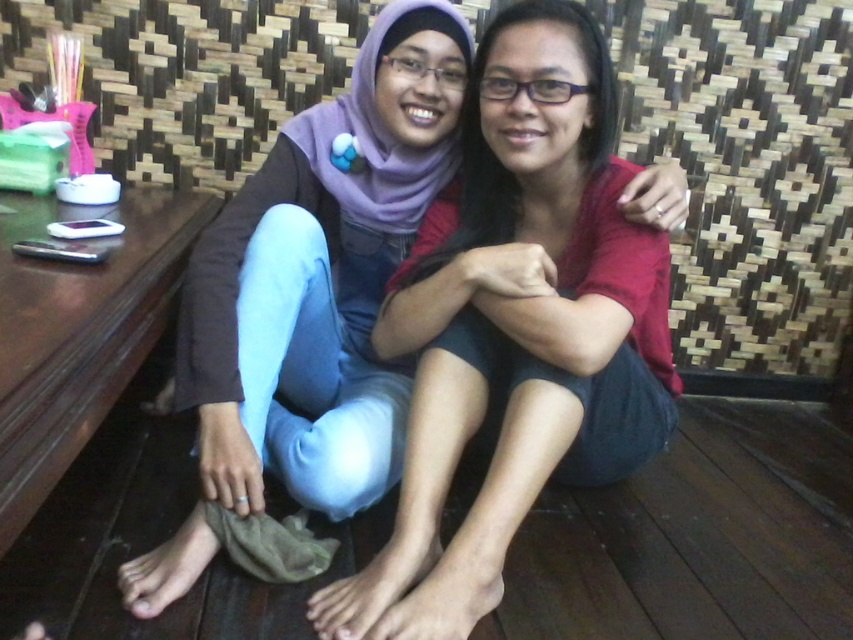
Question: Does purple fabric hijab at center have a greater width compared to brown wooden table at lower left?

Choices:
 (A) yes
 (B) no

Answer: (A)

Question: Can you confirm if purple fabric hijab at center is positioned to the left of brown wooden table at lower left?

Choices:
 (A) no
 (B) yes

Answer: (A)

Question: Which object is closer to the camera taking this photo?

Choices:
 (A) purple fabric hijab at center
 (B) brown wooden table at lower left

Answer: (B)

Question: Does purple fabric hijab at center come behind brown wooden table at lower left?

Choices:
 (A) no
 (B) yes

Answer: (B)